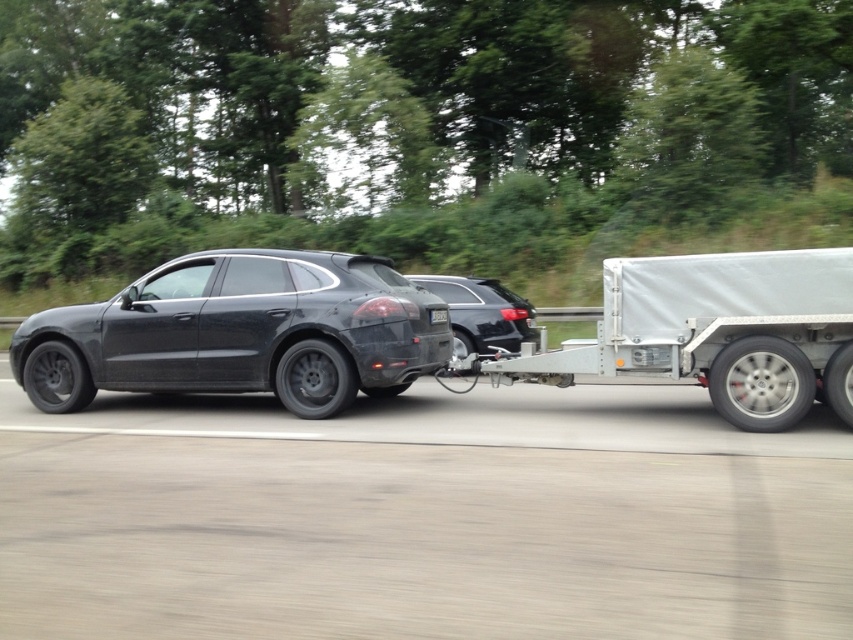
The height and width of the screenshot is (640, 853). Find the location of `matte black suv at left`. matte black suv at left is located at coordinates (241, 332).

Who is lower down, matte black suv at left or silver metallic trailer at right?

Positioned lower is silver metallic trailer at right.

What are the coordinates of `matte black suv at left` in the screenshot? It's located at (241, 332).

Image resolution: width=853 pixels, height=640 pixels. In order to click on matte black suv at left in this screenshot , I will do `click(241, 332)`.

Is silver metallic trailer at right to the left of satin black car at center from the viewer's perspective?

No, silver metallic trailer at right is not to the left of satin black car at center.

Find the location of `silver metallic trailer at right`. silver metallic trailer at right is located at coordinates (717, 332).

Between point (769, 410) and point (498, 321), which one is positioned behind?

The point (498, 321) is behind.

Image resolution: width=853 pixels, height=640 pixels. Find the location of `silver metallic trailer at right`. silver metallic trailer at right is located at coordinates (717, 332).

Can you confirm if matte black suv at left is smaller than satin black car at center?

No, matte black suv at left is not smaller than satin black car at center.

Does matte black suv at left appear on the left side of satin black car at center?

Correct, you'll find matte black suv at left to the left of satin black car at center.

Who is more forward, (x=305, y=340) or (x=502, y=330)?

Point (x=305, y=340) is in front.

This screenshot has width=853, height=640. In order to click on matte black suv at left in this screenshot , I will do `click(241, 332)`.